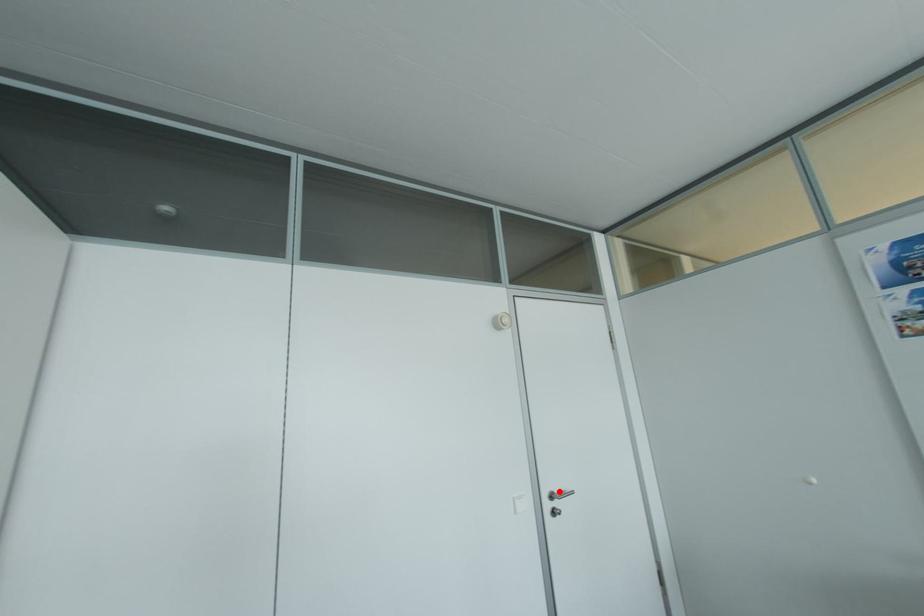
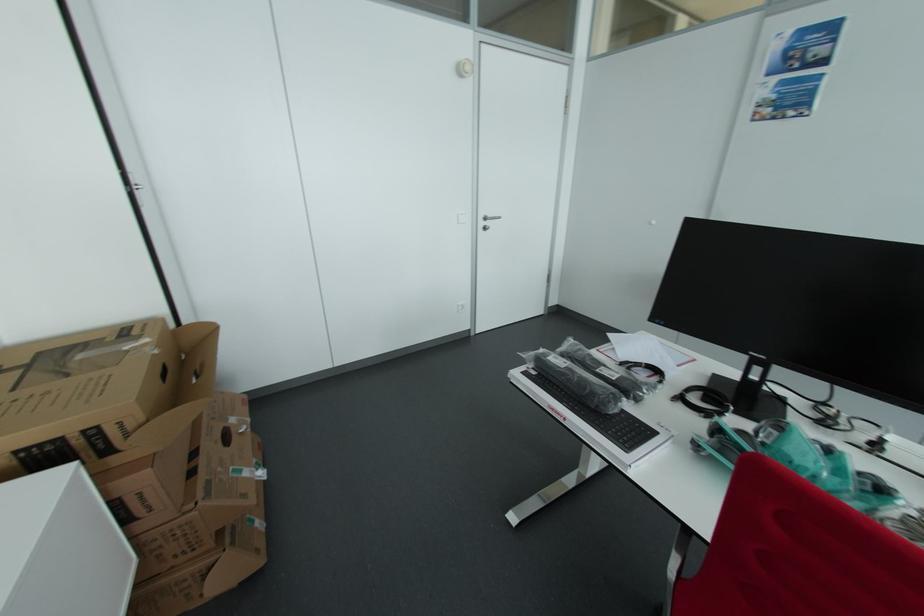
Question: I am providing you with two images of the same scene from different viewpoints. In image1, a red point is highlighted. Considering the same 3D point in image2, which of the following is correct?

Choices:
 (A) It is closer
 (B) It is farther

Answer: (A)